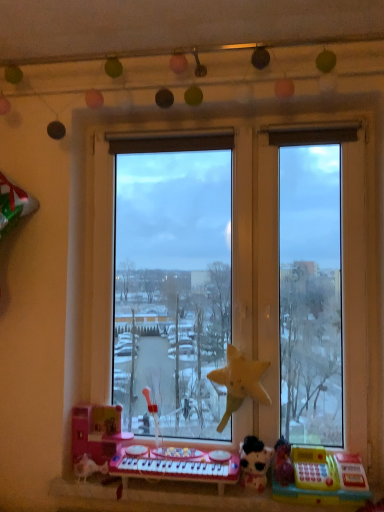
Question: Which direction should I rotate to look at pink plastic musical keyboard at lower center?

Choices:
 (A) left
 (B) right

Answer: (A)

Question: Would you consider plastic toy keyboard at lower center to be distant from yellow matte star at center, the 2th toy when ordered from left to right?

Choices:
 (A) yes
 (B) no

Answer: (B)

Question: Is plastic toy keyboard at lower center facing towards yellow matte star at center, the 3th toy positioned from the right?

Choices:
 (A) yes
 (B) no

Answer: (B)

Question: From the image's perspective, is plastic toy keyboard at lower center located beneath yellow matte star at center, the 2th toy when ordered from left to right?

Choices:
 (A) yes
 (B) no

Answer: (A)

Question: Considering the relative sizes of plastic toy keyboard at lower center and yellow matte star at center, the 2th toy when ordered from left to right, in the image provided, is plastic toy keyboard at lower center thinner than yellow matte star at center, the 2th toy when ordered from left to right,?

Choices:
 (A) yes
 (B) no

Answer: (B)

Question: Does plastic toy keyboard at lower center have a greater height compared to yellow matte star at center, the 3th toy positioned from the right?

Choices:
 (A) no
 (B) yes

Answer: (A)

Question: Are plastic toy keyboard at lower center and yellow matte star at center, the 2th toy when ordered from left to right, beside each other?

Choices:
 (A) yes
 (B) no

Answer: (B)

Question: Would you say white plush cat at lower right, which is the 2th toy from right to left, is a long distance from yellow plastic cash register at lower right, placed as the first toy when sorted from right to left?

Choices:
 (A) no
 (B) yes

Answer: (A)

Question: Considering the relative sizes of white plush cat at lower right, which is the 2th toy from right to left, and yellow plastic cash register at lower right, placed as the first toy when sorted from right to left, in the image provided, is white plush cat at lower right, which is the 2th toy from right to left, smaller than yellow plastic cash register at lower right, placed as the first toy when sorted from right to left,?

Choices:
 (A) no
 (B) yes

Answer: (B)

Question: Is white plush cat at lower right, which is counted as the third toy, starting from the left, aimed at yellow plastic cash register at lower right, placed as the first toy when sorted from right to left?

Choices:
 (A) no
 (B) yes

Answer: (A)

Question: From a real-world perspective, is white plush cat at lower right, which is counted as the third toy, starting from the left, located beneath yellow plastic cash register at lower right, positioned as the fourth toy in left-to-right order?

Choices:
 (A) no
 (B) yes

Answer: (A)

Question: From the image's perspective, would you say white plush cat at lower right, which is the 2th toy from right to left, is shown under yellow plastic cash register at lower right, placed as the first toy when sorted from right to left?

Choices:
 (A) no
 (B) yes

Answer: (A)

Question: Does white plush cat at lower right, which is the 2th toy from right to left, have a lesser width compared to yellow plastic cash register at lower right, positioned as the fourth toy in left-to-right order?

Choices:
 (A) yes
 (B) no

Answer: (A)

Question: Would you say plastic toy keyboard at lower center contains pink plastic toy at lower left, placed as the 1th toy when sorted from left to right?

Choices:
 (A) yes
 (B) no

Answer: (B)